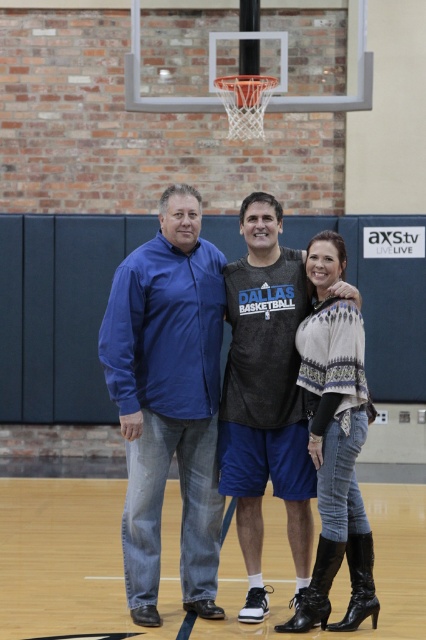
You are a photographer positioned at the entrance of the basketball court. You want to take a photo of the blue denim jeans at left and the knit sweater at center. Which object should you focus on first to ensure both are in clear view?

The blue denim jeans at left is closer to you than the knit sweater at center, so focus on the blue denim jeans at left first to ensure both are in clear view.

You are a photographer setting up a shoot on an indoor basketball court. You need to position a light to the left of the matte black jersey at center and to the right of the blue denim jeans at left. Is this possible given their positions?

Result: The matte black jersey at center is to the right of the blue denim jeans at left, so placing a light to the left of the matte black jersey at center and to the right of the blue denim jeans at left is possible between them.

You are standing in the middle of the basketball court and want to throw a ball to the blue denim jeans at left. In which direction should you throw the ball?

You should throw the ball to the left direction because the blue denim jeans at left is located at point (169, 401), which is to the left side of the court.